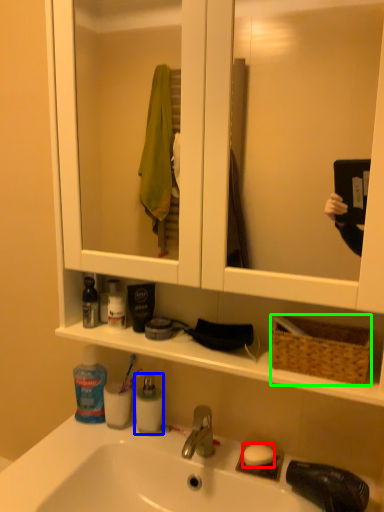
Question: Which object is the closest to the soap (highlighted by a red box)? Choose among these: cleaning product (highlighted by a blue box) or picnic basket (highlighted by a green box).

Choices:
 (A) cleaning product
 (B) picnic basket

Answer: (A)